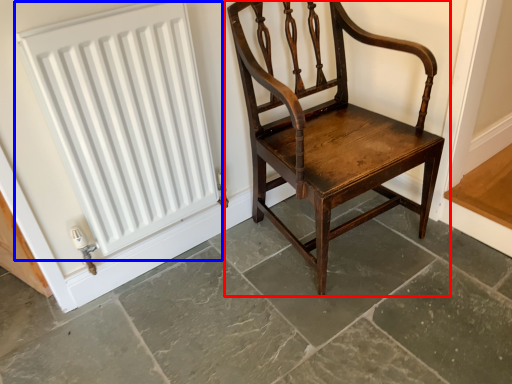
Question: Which object appears closest to the camera in this image, chair (highlighted by a red box) or radiator (highlighted by a blue box)?

Choices:
 (A) chair
 (B) radiator

Answer: (A)